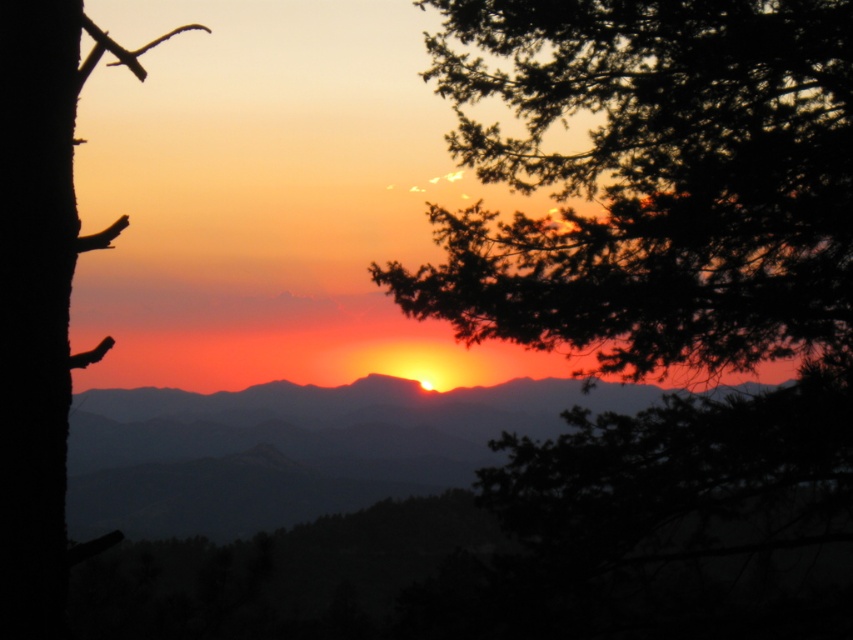
Which is behind, point (780, 289) or point (206, 468)?

Point (206, 468)

Which of these two, silhouette pine branch at upper right or silhouetted mountain at center, stands taller?

Standing taller between the two is silhouette pine branch at upper right.

This screenshot has width=853, height=640. Find the location of `silhouette pine branch at upper right`. silhouette pine branch at upper right is located at coordinates (653, 180).

Is silhouetted mountain at center below silky brown tree trunk at left?

Correct, silhouetted mountain at center is located below silky brown tree trunk at left.

Who is positioned more to the right, silhouetted mountain at center or silky brown tree trunk at left?

From the viewer's perspective, silky brown tree trunk at left appears more on the right side.

What do you see at coordinates (294, 449) in the screenshot? I see `silhouetted mountain at center` at bounding box center [294, 449].

Locate an element on the screen. The width and height of the screenshot is (853, 640). silhouetted mountain at center is located at coordinates (294, 449).

Is silhouette pine branch at upper right closer to camera compared to silky brown tree trunk at left?

No, it is not.

Is silhouette pine branch at upper right above silky brown tree trunk at left?

Yes.

Is point (637, 154) less distant than point (117, 536)?

No, it is behind (117, 536).

Locate an element on the screen. Image resolution: width=853 pixels, height=640 pixels. silhouette pine branch at upper right is located at coordinates (653, 180).